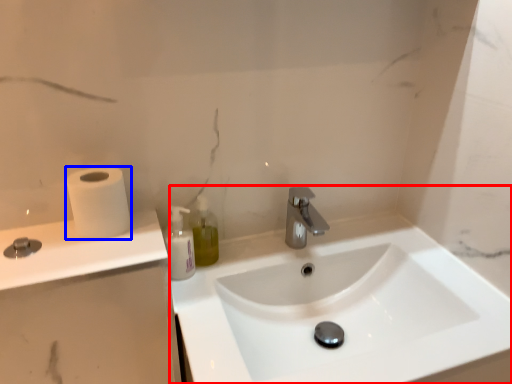
Question: Among these objects, which one is farthest to the camera, sink (highlighted by a red box) or toilet paper (highlighted by a blue box)?

Choices:
 (A) sink
 (B) toilet paper

Answer: (B)